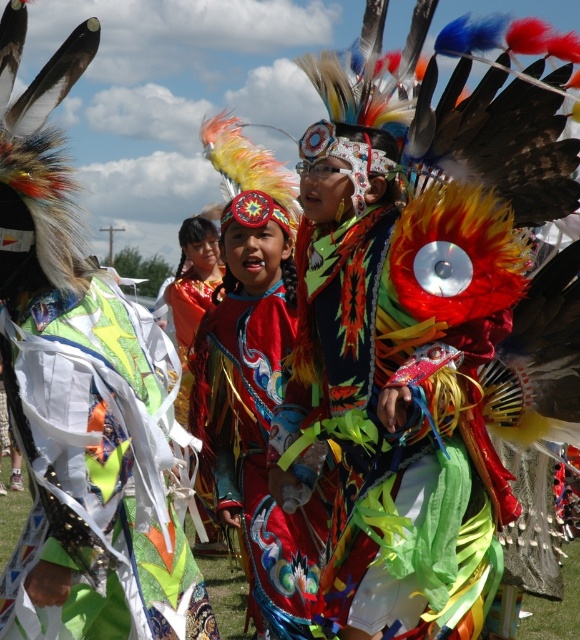
You are a photographer at the event and want to capture both the shiny metallic fabric at center and the shiny silk dress at center in the same frame. Your camera has a maximum focus range of 2 meters. Can you fit both subjects within the camera frame?

The shiny metallic fabric at center is 2.14 meters from the shiny silk dress at center, which exceeds the camera maximum focus range of 2 meters. Therefore, you cannot fit both subjects within the camera frame.

You are a photographer at the event and want to capture both the shiny metallic fabric at center and the shiny silk dress at center in a single frame. Which object should you focus on first to ensure both are in the shot?

The shiny metallic fabric at center is shorter than the shiny silk dress at center, so you should focus on the shiny silk dress at center first to ensure both are in the shot.

In the scene shown: You are a photographer at the event and want to capture both the shiny metallic fabric at center and the shiny silk dress at center in the same frame. Based on their positions, which one should you adjust your camera angle to focus on first to ensure both are visible?

The shiny metallic fabric at center is positioned on the left side of the shiny silk dress at center. To capture both in the same frame, you should focus on the shiny silk dress at center first, then adjust your angle to include the shiny metallic fabric at center on the left.